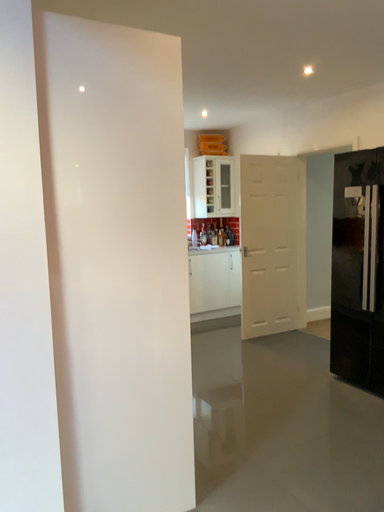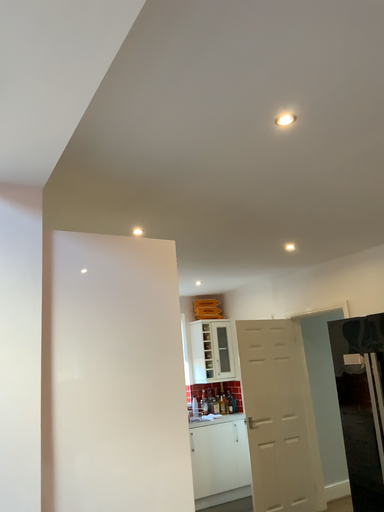
Question: Which way did the camera rotate in the video?

Choices:
 (A) rotated downward
 (B) rotated upward

Answer: (B)